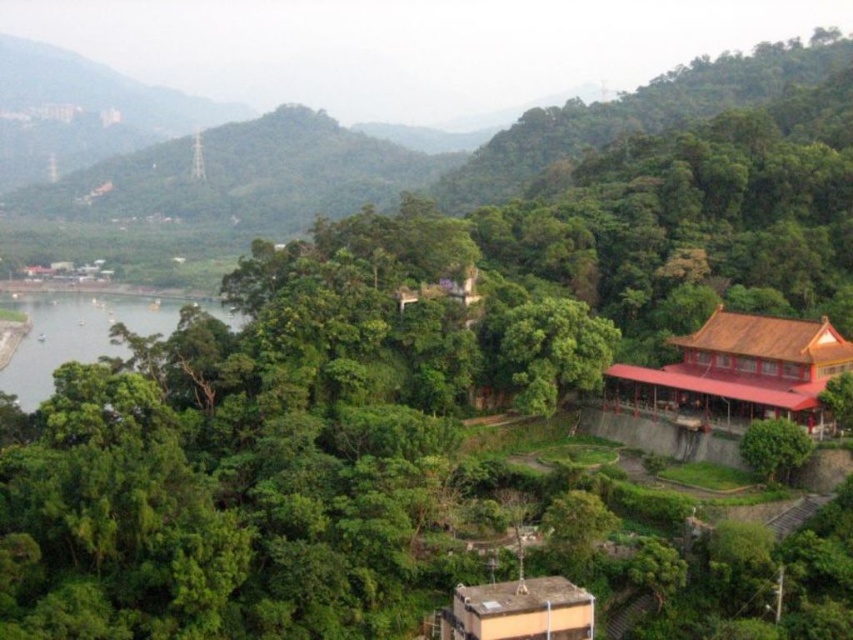
Question: Which object appears farthest from the camera in this image?

Choices:
 (A) green leafy tree at lower right
 (B) green leafy tree at center

Answer: (B)

Question: Can you confirm if green leafy river at lower left is positioned to the right of green leafy tree at lower right?

Choices:
 (A) no
 (B) yes

Answer: (A)

Question: Considering the relative positions of green leafy tree at center and green leafy tree at lower right in the image provided, where is green leafy tree at center located with respect to green leafy tree at lower right?

Choices:
 (A) left
 (B) right

Answer: (A)

Question: Which point is closer to the camera?

Choices:
 (A) green leafy river at lower left
 (B) green leafy tree at lower right

Answer: (B)

Question: Which point appears farthest from the camera in this image?

Choices:
 (A) (809, 442)
 (B) (548, 310)

Answer: (B)

Question: Observing the image, what is the correct spatial positioning of green leafy tree at center in reference to green leafy tree at lower right?

Choices:
 (A) right
 (B) left

Answer: (B)